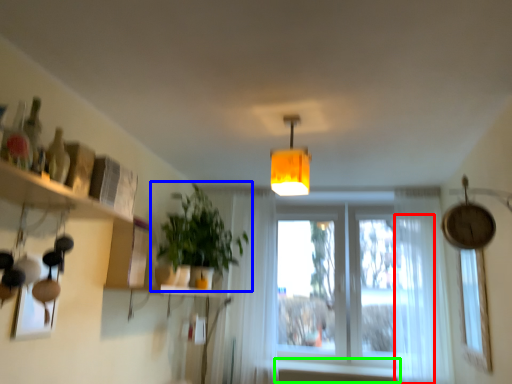
Question: Which object is positioned farthest from curtain (highlighted by a red box)? Select from houseplant (highlighted by a blue box) and window sill (highlighted by a green box).

Choices:
 (A) houseplant
 (B) window sill

Answer: (A)